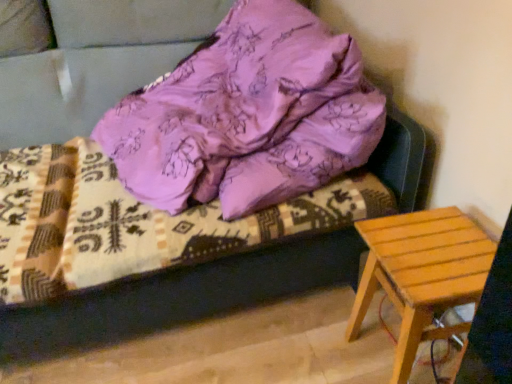
Question: Considering the relative sizes of purple satin pillow at upper center and purple satin bedding at upper center in the image provided, is purple satin pillow at upper center smaller than purple satin bedding at upper center?

Choices:
 (A) yes
 (B) no

Answer: (B)

Question: Does purple satin pillow at upper center have a greater width compared to purple satin bedding at upper center?

Choices:
 (A) yes
 (B) no

Answer: (A)

Question: Is purple satin pillow at upper center turned away from purple satin bedding at upper center?

Choices:
 (A) yes
 (B) no

Answer: (B)

Question: Is purple satin pillow at upper center to the left of purple satin bedding at upper center from the viewer's perspective?

Choices:
 (A) yes
 (B) no

Answer: (B)

Question: From a real-world perspective, is purple satin pillow at upper center located beneath purple satin bedding at upper center?

Choices:
 (A) no
 (B) yes

Answer: (A)

Question: Can we say purple satin pillow at upper center lies outside purple satin bedding at upper center?

Choices:
 (A) yes
 (B) no

Answer: (A)

Question: From a real-world perspective, is light brown wooden stool at lower right physically above purple satin pillow at upper center?

Choices:
 (A) no
 (B) yes

Answer: (A)

Question: Is light brown wooden stool at lower right looking in the opposite direction of purple satin pillow at upper center?

Choices:
 (A) yes
 (B) no

Answer: (B)

Question: Is light brown wooden stool at lower right thinner than purple satin pillow at upper center?

Choices:
 (A) no
 (B) yes

Answer: (B)

Question: Could purple satin pillow at upper center be considered to be inside light brown wooden stool at lower right?

Choices:
 (A) no
 (B) yes

Answer: (A)

Question: Is light brown wooden stool at lower right facing towards purple satin pillow at upper center?

Choices:
 (A) yes
 (B) no

Answer: (B)

Question: Is light brown wooden stool at lower right outside purple satin pillow at upper center?

Choices:
 (A) no
 (B) yes

Answer: (B)

Question: Is purple satin bedding at upper center not within light brown wooden stool at lower right?

Choices:
 (A) no
 (B) yes

Answer: (B)